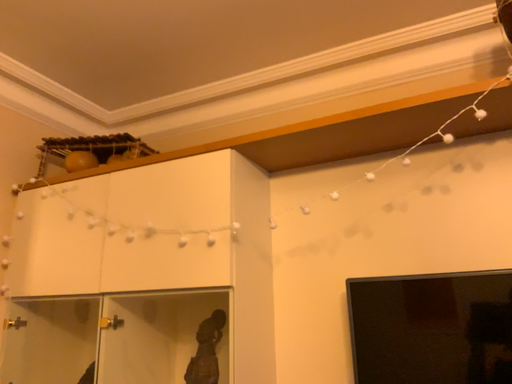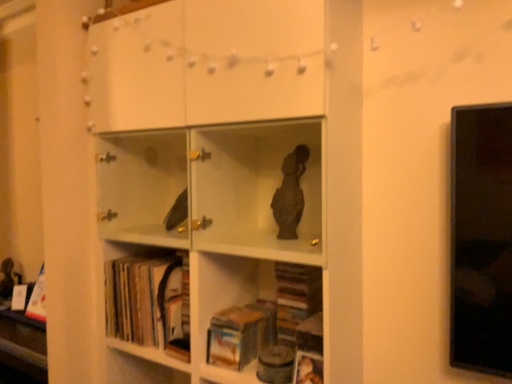
Question: Which way did the camera rotate in the video?

Choices:
 (A) rotated downward
 (B) rotated upward

Answer: (A)